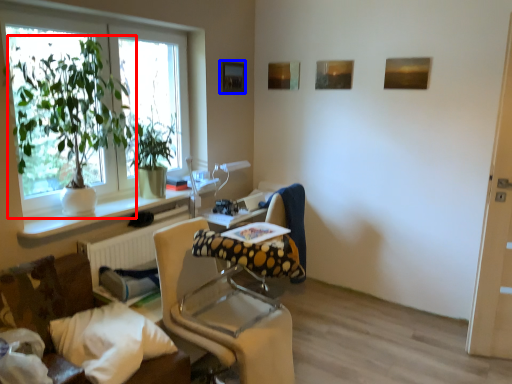
Question: Among these objects, which one is nearest to the camera, houseplant (highlighted by a red box) or picture frame (highlighted by a blue box)?

Choices:
 (A) houseplant
 (B) picture frame

Answer: (A)